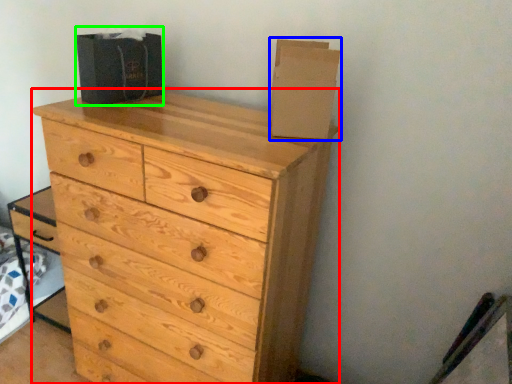
Question: Estimate the real-world distances between objects in this image. Which object is closer to chest of drawers (highlighted by a red box), cardboard box (highlighted by a blue box) or cardboard box (highlighted by a green box)?

Choices:
 (A) cardboard box
 (B) cardboard box

Answer: (A)